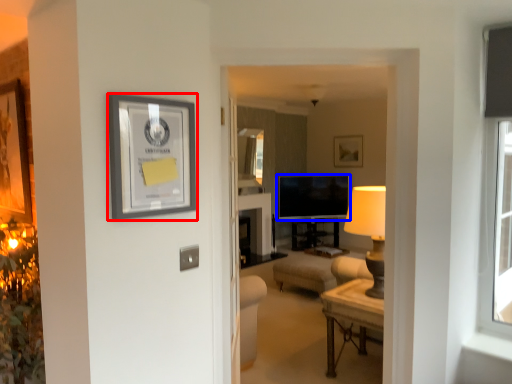
Question: Which of the following is the closest to the observer, picture frame (highlighted by a red box) or television (highlighted by a blue box)?

Choices:
 (A) picture frame
 (B) television

Answer: (A)